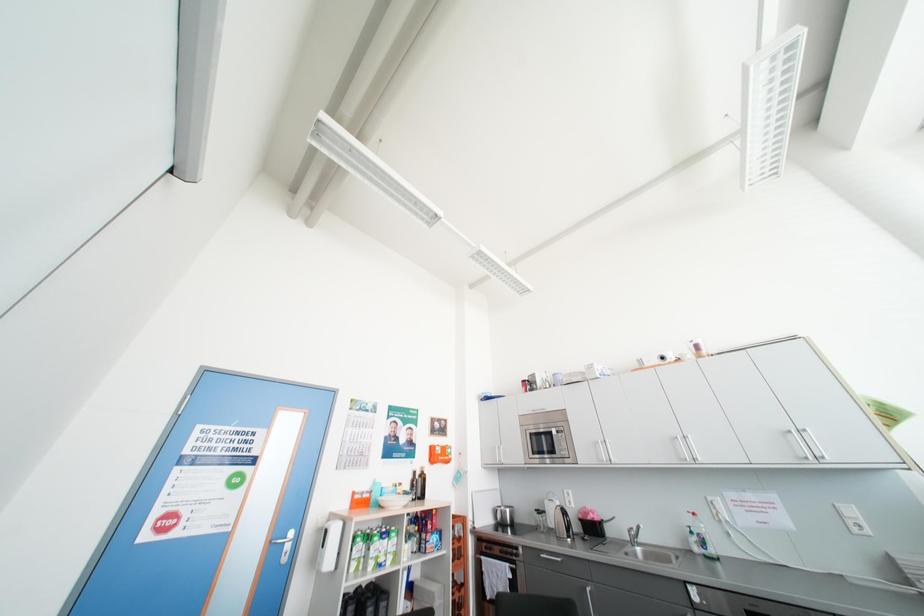
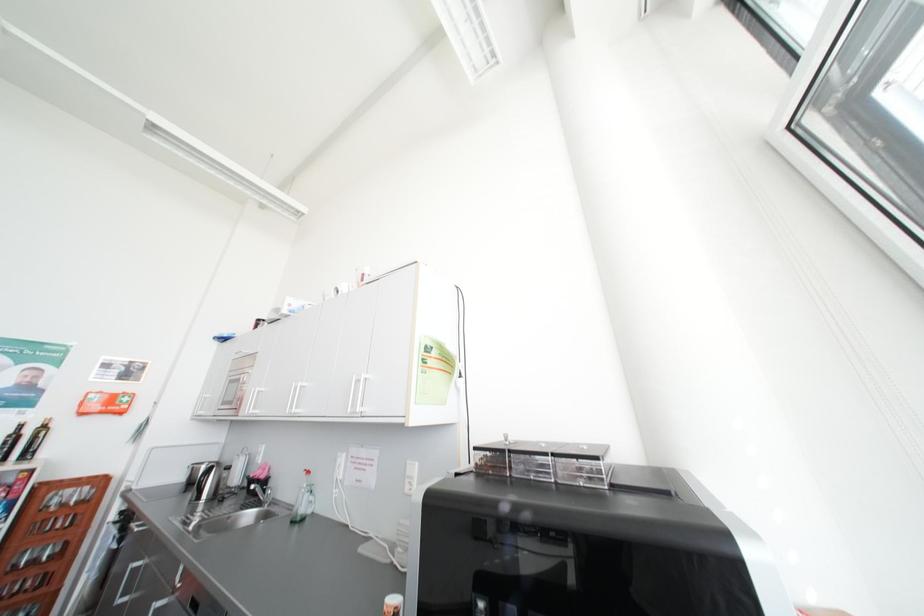
Question: In a continuous first-person perspective shot, in which direction is the camera moving?

Choices:
 (A) Left
 (B) Right
 (C) Forward
 (D) Backward

Answer: (B)